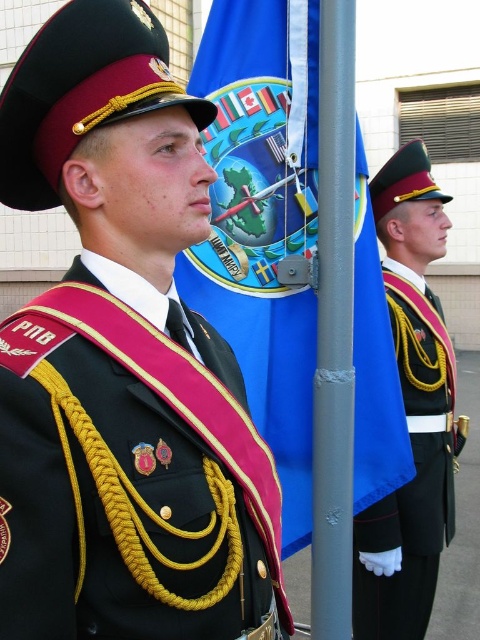
Question: Is gray metallic pole at center to the right of shiny black uniform at right from the viewer's perspective?

Choices:
 (A) no
 (B) yes

Answer: (A)

Question: Can you confirm if gray metallic pole at center is bigger than shiny black uniform at right?

Choices:
 (A) yes
 (B) no

Answer: (B)

Question: Which of these objects is positioned closest to the gray metallic pole at center?

Choices:
 (A) shiny black uniform at right
 (B) blue fabric flag at center
 (C) black satin sash at center

Answer: (B)

Question: Among these objects, which one is nearest to the camera?

Choices:
 (A) blue fabric flag at center
 (B) gray metallic pole at center
 (C) shiny black uniform at right

Answer: (B)

Question: Based on their relative distances, which object is nearer to the shiny black uniform at right?

Choices:
 (A) black satin sash at center
 (B) blue fabric flag at center
 (C) gray metallic pole at center

Answer: (B)

Question: Is blue fabric flag at center closer to the viewer compared to shiny black uniform at right?

Choices:
 (A) yes
 (B) no

Answer: (A)